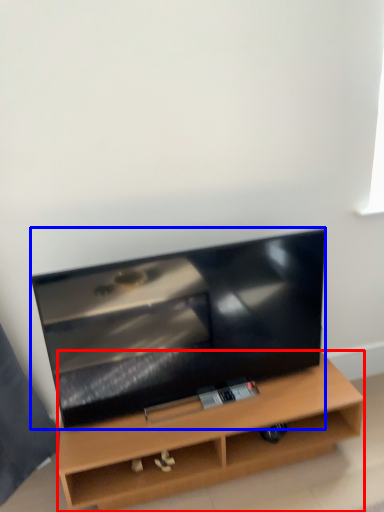
Question: Which object appears closest to the camera in this image, furniture (highlighted by a red box) or television (highlighted by a blue box)?

Choices:
 (A) furniture
 (B) television

Answer: (B)